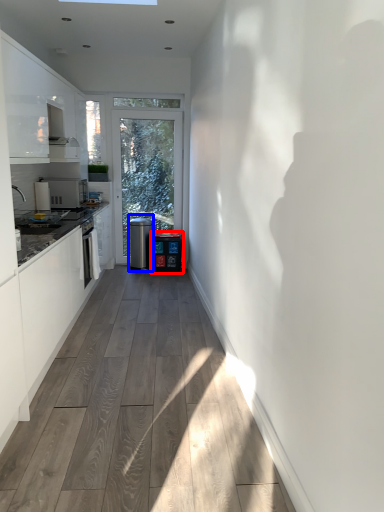
Question: Among these objects, which one is farthest to the camera, water cooler (highlighted by a red box) or water cooler (highlighted by a blue box)?

Choices:
 (A) water cooler
 (B) water cooler

Answer: (B)